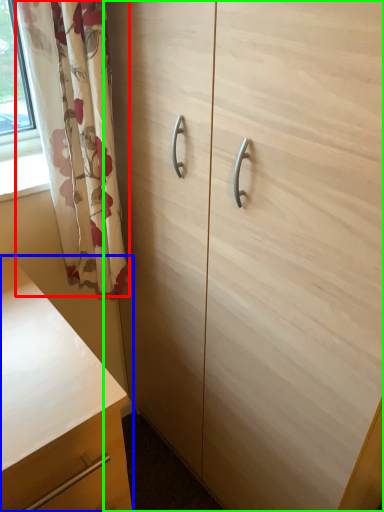
Question: Considering the real-world distances, which object is closest to curtain (highlighted by a red box)? chest of drawers (highlighted by a blue box) or cabinetry (highlighted by a green box).

Choices:
 (A) chest of drawers
 (B) cabinetry

Answer: (B)